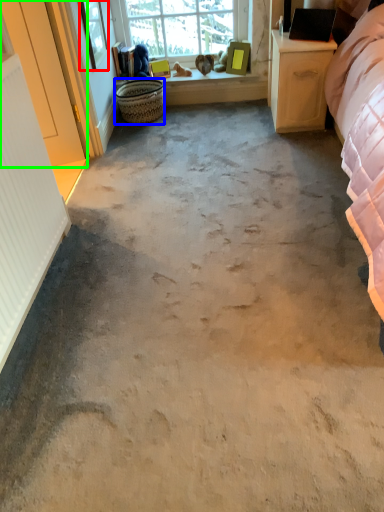
Question: Estimate the real-world distances between objects in this image. Which object is closer to window screen (highlighted by a red box), basket (highlighted by a blue box) or screen door (highlighted by a green box)?

Choices:
 (A) basket
 (B) screen door

Answer: (A)